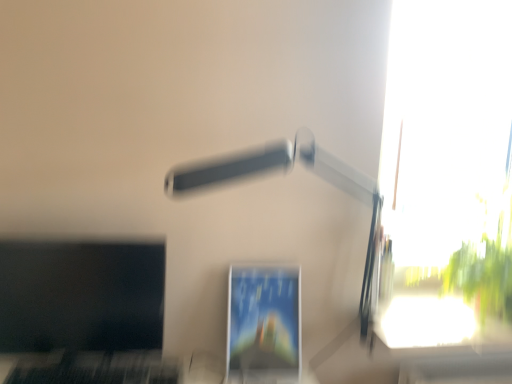
Question: Is matte plastic monitor at center, which is the first computer monitor from right to left, looking in the opposite direction of white plastic lamp at upper center?

Choices:
 (A) yes
 (B) no

Answer: (A)

Question: Is matte plastic monitor at center, which is the first computer monitor from right to left, not inside white plastic lamp at upper center?

Choices:
 (A) no
 (B) yes

Answer: (A)

Question: Is matte plastic monitor at center, which is the first computer monitor from right to left, positioned behind white plastic lamp at upper center?

Choices:
 (A) no
 (B) yes

Answer: (B)

Question: Could white plastic lamp at upper center be considered to be inside matte plastic monitor at center, which is the first computer monitor from right to left?

Choices:
 (A) no
 (B) yes

Answer: (A)

Question: Can you confirm if matte plastic monitor at center, the second computer monitor from the left, is bigger than white plastic lamp at upper center?

Choices:
 (A) no
 (B) yes

Answer: (A)

Question: From the image's perspective, is matte plastic monitor at center, which is the first computer monitor from right to left, located beneath white plastic lamp at upper center?

Choices:
 (A) yes
 (B) no

Answer: (A)

Question: From the image's perspective, is matte plastic monitor at center, the second computer monitor from the left, located above transparent glass window at upper right?

Choices:
 (A) yes
 (B) no

Answer: (B)

Question: From a real-world perspective, does matte plastic monitor at center, the second computer monitor from the left, sit lower than transparent glass window at upper right?

Choices:
 (A) no
 (B) yes

Answer: (B)

Question: Considering the relative positions of matte plastic monitor at center, which is the first computer monitor from right to left, and transparent glass window at upper right in the image provided, is matte plastic monitor at center, which is the first computer monitor from right to left, to the right of transparent glass window at upper right from the viewer's perspective?

Choices:
 (A) no
 (B) yes

Answer: (A)

Question: Considering the relative positions of matte plastic monitor at center, the second computer monitor from the left, and transparent glass window at upper right in the image provided, is matte plastic monitor at center, the second computer monitor from the left, in front of transparent glass window at upper right?

Choices:
 (A) no
 (B) yes

Answer: (B)

Question: Does matte plastic monitor at center, the second computer monitor from the left, touch transparent glass window at upper right?

Choices:
 (A) no
 (B) yes

Answer: (A)

Question: Considering the relative sizes of matte plastic monitor at center, which is the first computer monitor from right to left, and transparent glass window at upper right in the image provided, is matte plastic monitor at center, which is the first computer monitor from right to left, bigger than transparent glass window at upper right?

Choices:
 (A) no
 (B) yes

Answer: (A)

Question: Does white plastic lamp at upper center appear on the left side of matte plastic monitor at center, which is the first computer monitor from right to left?

Choices:
 (A) yes
 (B) no

Answer: (B)